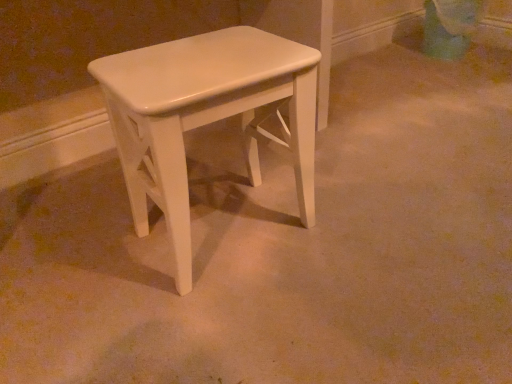
Measure the distance between point (431, 30) and camera.

The depth of point (431, 30) is 1.97 meters.

Image resolution: width=512 pixels, height=384 pixels. Describe the element at coordinates (450, 27) in the screenshot. I see `matte green swivel chair at upper right` at that location.

Locate an element on the screen. The height and width of the screenshot is (384, 512). matte green swivel chair at upper right is located at coordinates (450, 27).

Measure the distance between white glossy stool at center and camera.

The depth of white glossy stool at center is 67.71 centimeters.

You are a GUI agent. You are given a task and a screenshot of the screen. Output one action in this format:
    pyautogui.click(x=<x>, y=<y>)
    Task: Click on the white glossy stool at center
    This screenshot has width=512, height=384.
    Given the screenshot: What is the action you would take?
    pyautogui.click(x=206, y=116)

What do you see at coordinates (206, 116) in the screenshot? I see `white glossy stool at center` at bounding box center [206, 116].

Find the location of a particular element. The height and width of the screenshot is (384, 512). matte green swivel chair at upper right is located at coordinates (450, 27).

Considering the relative positions of white glossy stool at center and matte green swivel chair at upper right in the image provided, is white glossy stool at center to the left or to the right of matte green swivel chair at upper right?

white glossy stool at center is positioned on matte green swivel chair at upper right's left side.

Is white glossy stool at center positioned behind matte green swivel chair at upper right?

No, white glossy stool at center is closer to the camera.

Does point (134, 150) lie behind point (439, 46)?

No, it is in front of (439, 46).

From the image's perspective, relative to matte green swivel chair at upper right, is white glossy stool at center above or below?

white glossy stool at center is situated lower than matte green swivel chair at upper right in the image.

From a real-world perspective, is white glossy stool at center on top of matte green swivel chair at upper right?

Indeed, from a real-world perspective, white glossy stool at center stands above matte green swivel chair at upper right.

Which object is wider, white glossy stool at center or matte green swivel chair at upper right?

With larger width is white glossy stool at center.

From their relative heights in the image, would you say white glossy stool at center is taller or shorter than matte green swivel chair at upper right?

In the image, white glossy stool at center appears to be taller than matte green swivel chair at upper right.

Between white glossy stool at center and matte green swivel chair at upper right, which one has smaller size?

With smaller size is matte green swivel chair at upper right.

Could matte green swivel chair at upper right be considered to be inside white glossy stool at center?

No, white glossy stool at center does not contain matte green swivel chair at upper right.

Is white glossy stool at center placed right next to matte green swivel chair at upper right?

They are not placed beside each other.

Is white glossy stool at center positioned with its back to matte green swivel chair at upper right?

white glossy stool at center is not turned away from matte green swivel chair at upper right.

At what (x,y) coordinates should I click in order to perform the action: click on stool lying on the left of matte green swivel chair at upper right. Please return your answer as a coordinate pair (x, y). The height and width of the screenshot is (384, 512). Looking at the image, I should click on (206, 116).

In the image, is matte green swivel chair at upper right on the left side or the right side of white glossy stool at center?

From the image, it's evident that matte green swivel chair at upper right is to the right of white glossy stool at center.

Does matte green swivel chair at upper right come in front of white glossy stool at center?

No, it is not.

Between point (426, 28) and point (306, 95), which one is positioned in front?

The point (306, 95) is closer to the camera.

From the image's perspective, which is above, matte green swivel chair at upper right or white glossy stool at center?

From the image's view, matte green swivel chair at upper right is above.

From a real-world perspective, is matte green swivel chair at upper right physically above white glossy stool at center?

No, from a real-world perspective, matte green swivel chair at upper right is not above white glossy stool at center.

Considering the relative sizes of matte green swivel chair at upper right and white glossy stool at center in the image provided, is matte green swivel chair at upper right thinner than white glossy stool at center?

Correct, the width of matte green swivel chair at upper right is less than that of white glossy stool at center.

From their relative heights in the image, would you say matte green swivel chair at upper right is taller or shorter than white glossy stool at center?

Clearly, matte green swivel chair at upper right is shorter compared to white glossy stool at center.

In terms of size, does matte green swivel chair at upper right appear bigger or smaller than white glossy stool at center?

Clearly, matte green swivel chair at upper right is smaller in size than white glossy stool at center.

Choose the correct answer: Is matte green swivel chair at upper right inside white glossy stool at center or outside it?

matte green swivel chair at upper right is not enclosed by white glossy stool at center.

Is matte green swivel chair at upper right next to white glossy stool at center?

No, matte green swivel chair at upper right is not touching white glossy stool at center.

Does matte green swivel chair at upper right turn towards white glossy stool at center?

Yes, matte green swivel chair at upper right is turned towards white glossy stool at center.

Based on the photo, can you tell me how much matte green swivel chair at upper right and white glossy stool at center differ in facing direction?

The angle between the facing direction of matte green swivel chair at upper right and the facing direction of white glossy stool at center is 92.4 degrees.

Looking at this image, how distant is matte green swivel chair at upper right from white glossy stool at center?

matte green swivel chair at upper right and white glossy stool at center are 1.45 meters apart from each other.

This screenshot has width=512, height=384. Find the location of `swivel chair beneath the white glossy stool at center (from a real-world perspective)`. swivel chair beneath the white glossy stool at center (from a real-world perspective) is located at coordinates (x=450, y=27).

Identify the location of swivel chair beneath the white glossy stool at center (from a real-world perspective). (450, 27).

Find the location of a particular element. stool in front of the matte green swivel chair at upper right is located at coordinates (206, 116).